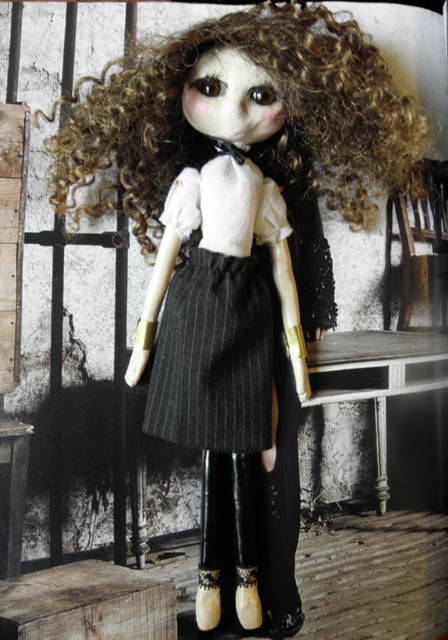
Looking at this image, does curly blonde hair at center lie in front of dark gray pinstriped skirt at center?

Yes, curly blonde hair at center is in front of dark gray pinstriped skirt at center.

Between curly blonde hair at center and dark gray pinstriped skirt at center, which one is positioned lower?

dark gray pinstriped skirt at center is below.

What do you see at coordinates (267, 140) in the screenshot? This screenshot has width=448, height=640. I see `curly blonde hair at center` at bounding box center [267, 140].

Find the location of a particular element. This screenshot has height=640, width=448. curly blonde hair at center is located at coordinates (267, 140).